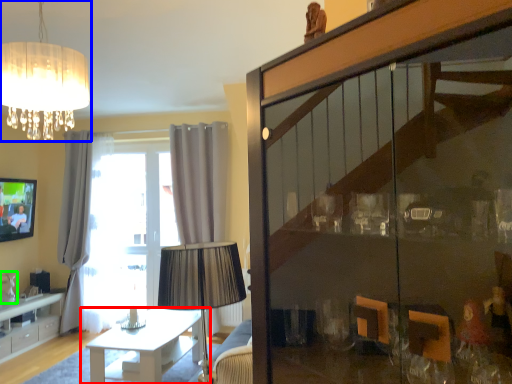
Question: Based on their relative distances, which object is farther from table (highlighted by a red box)? Choose from lamp (highlighted by a blue box) and glass vase (highlighted by a green box).

Choices:
 (A) lamp
 (B) glass vase

Answer: (A)